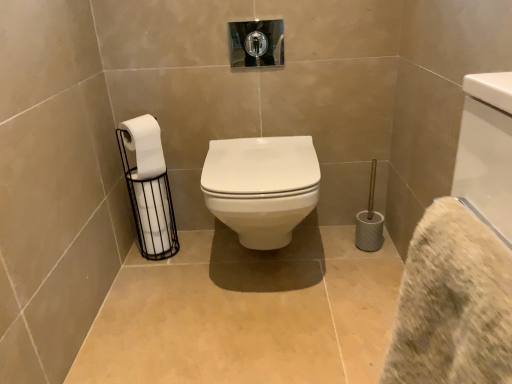
Question: Considering the positions of white matte toilet paper at left, which is the 1th toilet paper in top-to-bottom order, and white matte toilet paper at left, which is the 2th toilet paper in top-to-bottom order, in the image, is white matte toilet paper at left, which is the 1th toilet paper in top-to-bottom order, bigger or smaller than white matte toilet paper at left, which is the 2th toilet paper in top-to-bottom order,?

Choices:
 (A) big
 (B) small

Answer: (B)

Question: Is white matte toilet paper at left, the second toilet paper in the bottom-to-top sequence, situated inside white matte toilet paper at left, which is the 1th toilet paper from bottom to top, or outside?

Choices:
 (A) outside
 (B) inside

Answer: (B)

Question: Which object is positioned farthest from the white glossy toilet at center?

Choices:
 (A) beige textured bath towel at lower right
 (B) white matte toilet paper at left, which is the 1th toilet paper from bottom to top
 (C) white matte toilet paper at left, which is the 1th toilet paper in top-to-bottom order

Answer: (A)

Question: Which of these objects is positioned farthest from the white matte toilet paper at left, which is the 1th toilet paper in top-to-bottom order?

Choices:
 (A) white matte toilet paper at left, which is the 1th toilet paper from bottom to top
 (B) white glossy toilet at center
 (C) beige textured bath towel at lower right

Answer: (C)